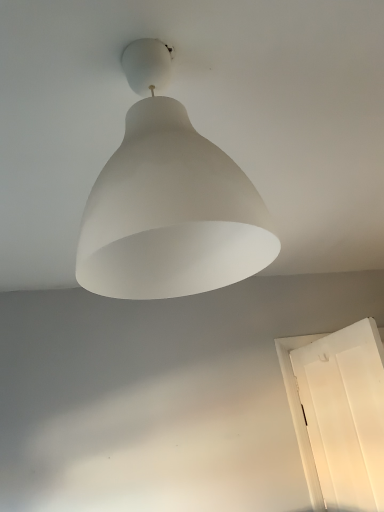
Question: Should I look upward or downward to see white matte door at lower right?

Choices:
 (A) up
 (B) down

Answer: (B)

Question: Does white matte door at lower right have a smaller size compared to white matte lampshade at center?

Choices:
 (A) yes
 (B) no

Answer: (B)

Question: Is white matte door at lower right at the right side of white matte lampshade at center?

Choices:
 (A) yes
 (B) no

Answer: (A)

Question: From the image's perspective, is white matte door at lower right located above white matte lampshade at center?

Choices:
 (A) no
 (B) yes

Answer: (A)

Question: Can you confirm if white matte door at lower right is shorter than white matte lampshade at center?

Choices:
 (A) no
 (B) yes

Answer: (A)

Question: From a real-world perspective, is white matte door at lower right beneath white matte lampshade at center?

Choices:
 (A) no
 (B) yes

Answer: (B)

Question: Does white matte door at lower right touch white matte lampshade at center?

Choices:
 (A) yes
 (B) no

Answer: (B)

Question: Is white matte lampshade at center facing towards white matte door at lower right?

Choices:
 (A) yes
 (B) no

Answer: (B)

Question: Does white matte lampshade at center have a greater width compared to white matte door at lower right?

Choices:
 (A) no
 (B) yes

Answer: (B)

Question: Does white matte lampshade at center have a lesser height compared to white matte door at lower right?

Choices:
 (A) yes
 (B) no

Answer: (A)

Question: Is white matte lampshade at center positioned beyond the bounds of white matte door at lower right?

Choices:
 (A) yes
 (B) no

Answer: (A)

Question: Does white matte lampshade at center have a larger size compared to white matte door at lower right?

Choices:
 (A) no
 (B) yes

Answer: (A)

Question: Does white matte lampshade at center have a lesser width compared to white matte door at lower right?

Choices:
 (A) no
 (B) yes

Answer: (A)

Question: In the image, is white matte door at lower right positioned in front of or behind white matte lampshade at center?

Choices:
 (A) front
 (B) behind

Answer: (B)